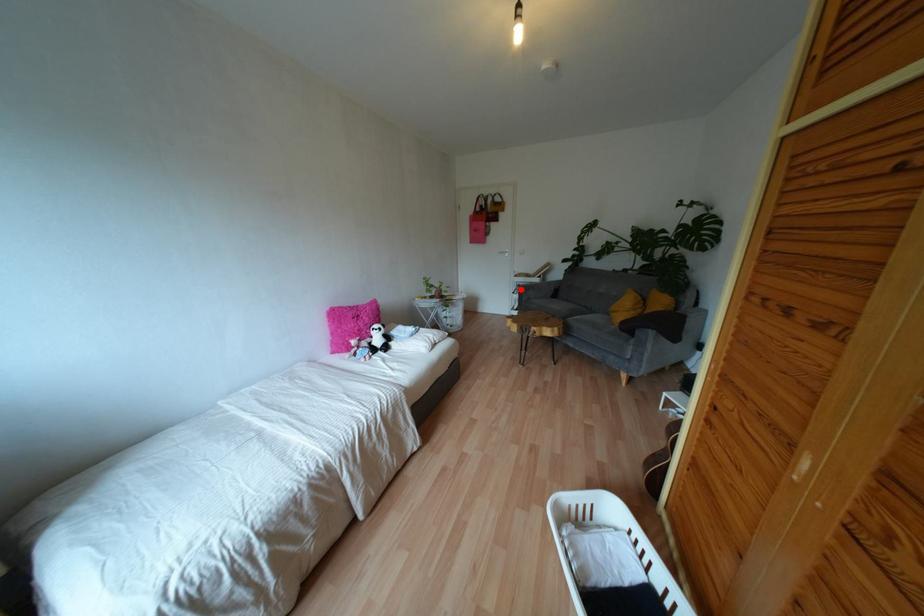
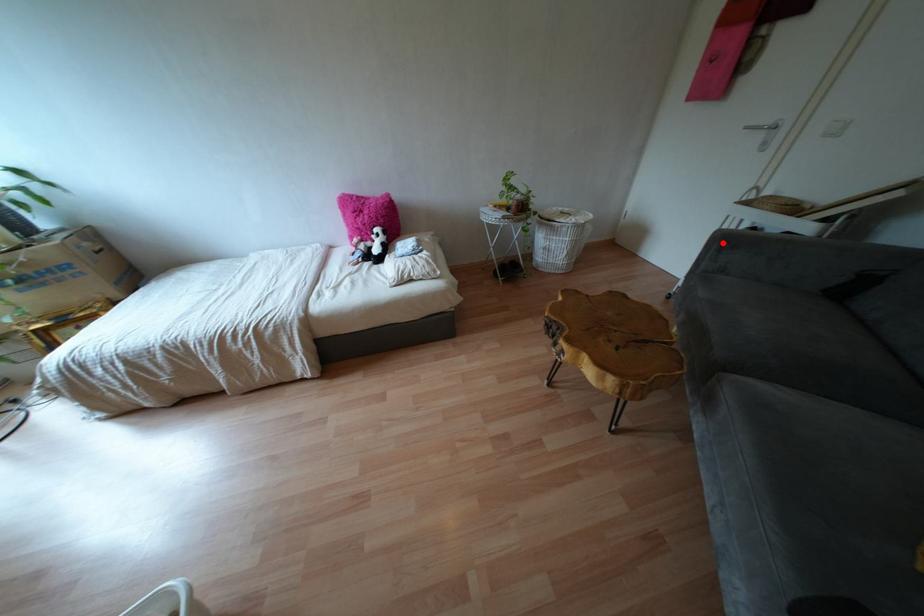
I am providing you with two images of the same scene from different viewpoints. A red point is marked on the first image and another point is marked on the second image. Does the point marked in image1 correspond to the same location as the one in image2?

Yes